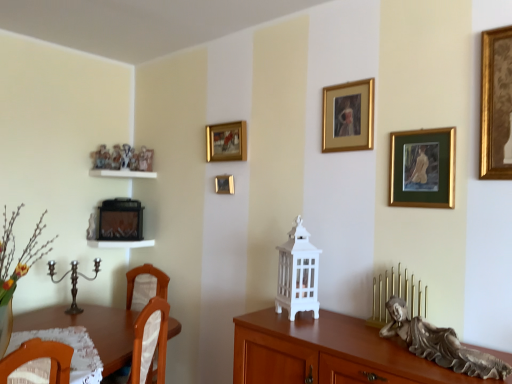
Identify the location of vacant space that is to the left of bronze statue at lower right. Image resolution: width=512 pixels, height=384 pixels. (355, 347).